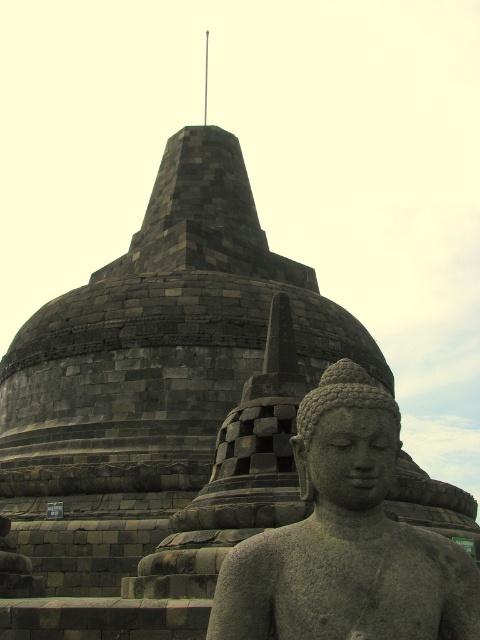
You are an archaeologist examining the historical site. You notice two gray stone objects at the center of the scene. Which one is wider, the gray stone statue at center or the gray stone buddha at center?

The gray stone statue at center might be wider than the gray stone buddha at center according to the description provided.

Based on the coordinates provided in the description, where is the gray stone statue at center positioned in the image?

The gray stone statue at center is located at point coordinates of (x=346, y=540).

You are a tour guide leading a group to the stupa. You want to ensure that visitors can comfortably view both the gray stone statue at center and the gray stone buddha at center without feeling cramped. What is the minimum distance you should recommend between the visitors and the statues to maintain a comfortable viewing experience?

The gray stone statue at center and the gray stone buddha at center are 4.86 feet apart from each other. To ensure a comfortable viewing experience without feeling cramped, visitors should maintain a distance of at least 5 feet from the statues.